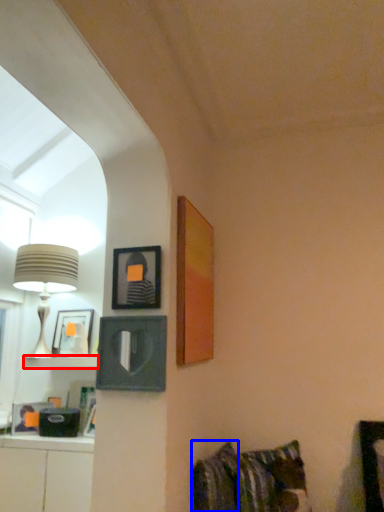
Question: Which of the following is the closest to the observer, shelf (highlighted by a red box) or pillow (highlighted by a blue box)?

Choices:
 (A) shelf
 (B) pillow

Answer: (B)